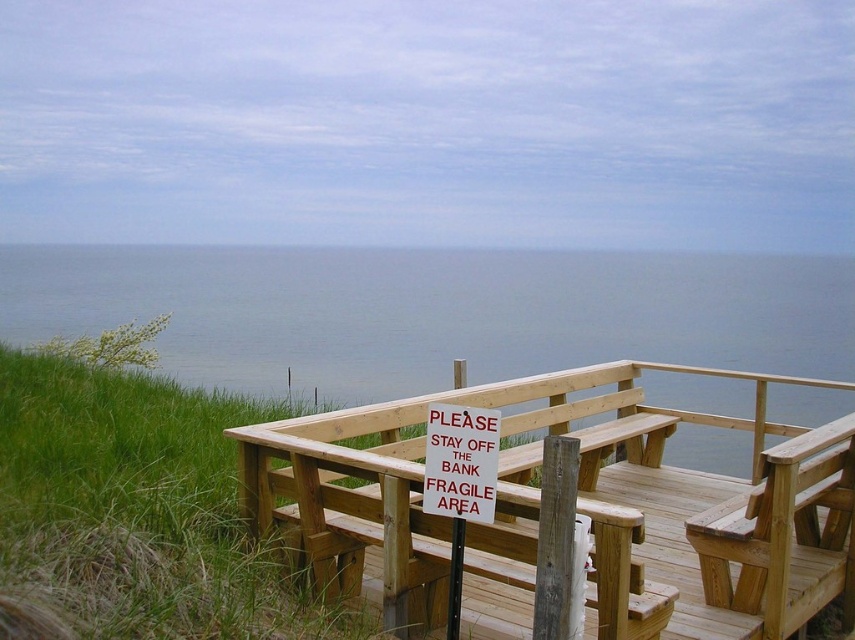
You are a visitor standing on the wooden deck. You see the blue water at upper center and the wooden bench at center. Which object is higher in elevation?

The blue water at upper center is positioned over the wooden bench at center, so the blue water at upper center is higher in elevation.

You are standing at the wooden deck overlooking the ocean and want to take a photo of the point at coordinates point (317, 307). If your camera has a maximum focus range of 13 meters, will it be able to focus on that point?

The distance of point (317, 307) from the camera is 13.62 meters, which exceeds the camera maximum focus range of 13 meters, so the camera cannot focus on that point.